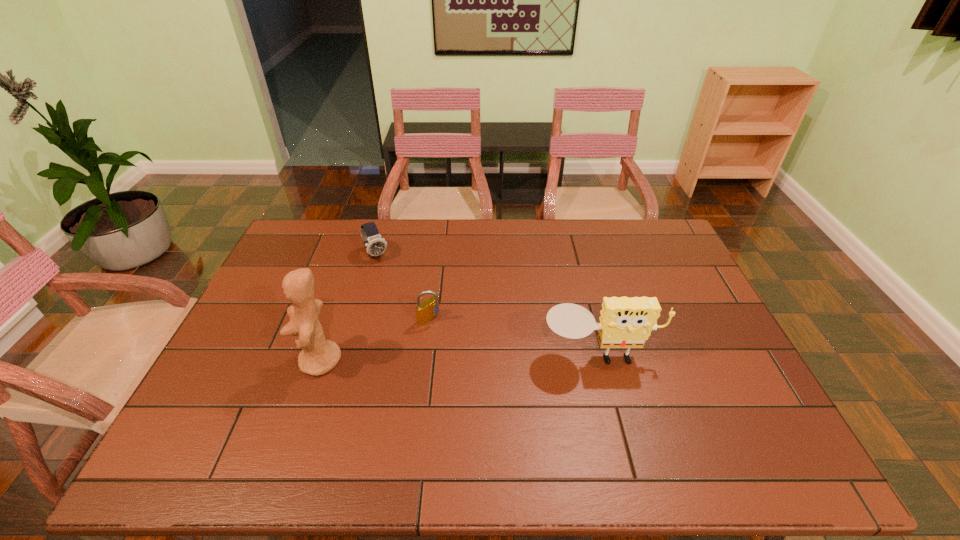
This screenshot has width=960, height=540. In order to click on free space on the desktop that is between the tallest object and the second tallest object and is positioned on the face of the farthest object in this screenshot , I will do `click(442, 359)`.

The width and height of the screenshot is (960, 540). I want to click on free space on the desktop that is between the figurine and the second tallest object and is positioned on the side with the combination dials of the padlock, so click(478, 358).